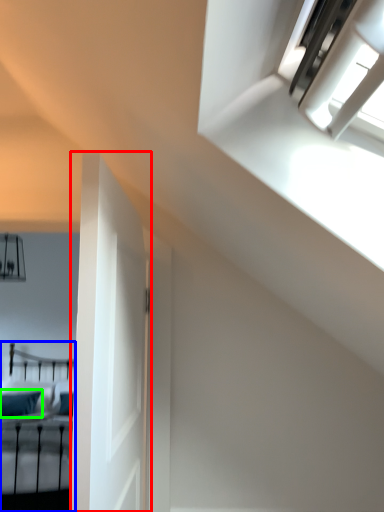
Question: Which object is positioned farthest from door (highlighted by a red box)? Select from bed (highlighted by a blue box) and pillow (highlighted by a green box).

Choices:
 (A) bed
 (B) pillow

Answer: (B)